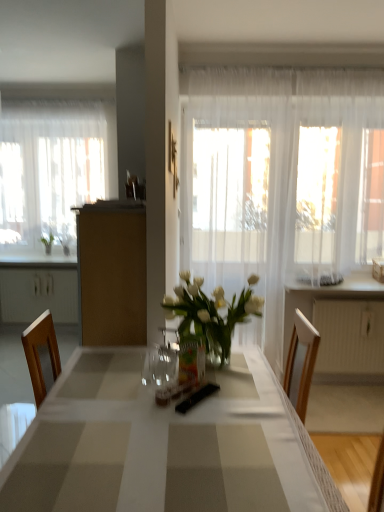
Question: Does point tap(223, 259) appear closer or farther from the camera than point tap(89, 220)?

Choices:
 (A) farther
 (B) closer

Answer: (A)

Question: Considering their positions, is sheer white curtain at center, positioned as the 1th curtain in front-to-back order, located in front of or behind brown matte cabinet at center?

Choices:
 (A) behind
 (B) front

Answer: (A)

Question: Considering the real-world distances, which object is closest to the white glossy countertop at right?

Choices:
 (A) white glossy table at center
 (B) sheer white curtain at left, the 1th curtain when ordered from left to right
 (C) sheer white curtain at center, positioned as the 1th curtain in front-to-back order
 (D) brown matte cabinet at center
 (E) white plastic radiator at right

Answer: (E)

Question: Which of these objects is positioned closest to the sheer white curtain at left, which ranks as the second curtain in front-to-back order?

Choices:
 (A) white glossy table at center
 (B) white glossy countertop at right
 (C) sheer white curtain at center, the 2th curtain positioned from the left
 (D) white plastic radiator at right
 (E) brown matte cabinet at center

Answer: (C)